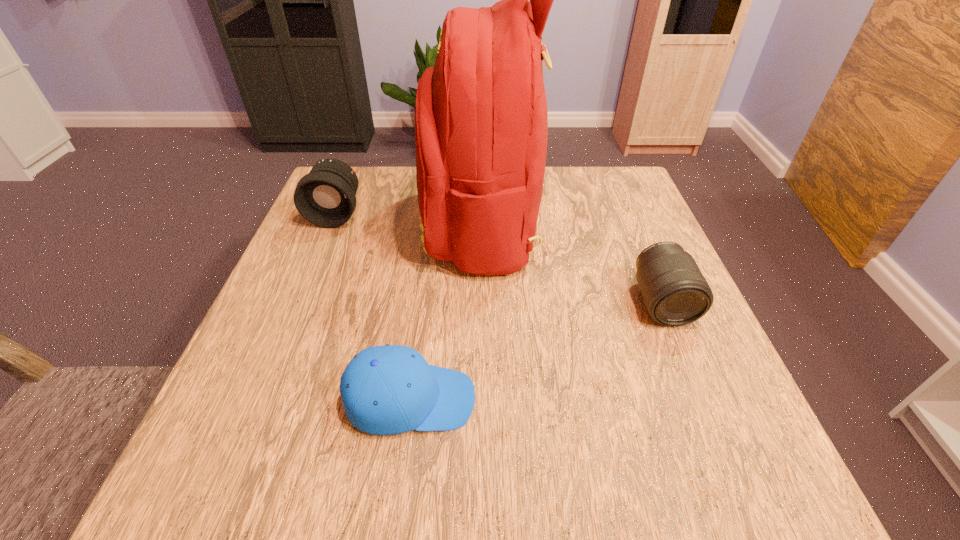
Image resolution: width=960 pixels, height=540 pixels. I want to click on the tallest object, so click(481, 121).

Locate an element on the screen. the left telephoto lens is located at coordinates (325, 196).

Find the location of a particular element. the leftmost object is located at coordinates (325, 196).

The width and height of the screenshot is (960, 540). I want to click on the nearer telephoto lens, so click(x=675, y=293).

Locate an element on the screen. the rightmost object is located at coordinates (675, 293).

Locate an element on the screen. The height and width of the screenshot is (540, 960). cap is located at coordinates (390, 389).

The image size is (960, 540). I want to click on vacant space located on the front-facing side of the backpack, so click(379, 224).

At what (x,y) coordinates should I click in order to perform the action: click on free space located on the front-facing side of the backpack. Please return your answer as a coordinate pair (x, y). Looking at the image, I should click on (384, 224).

Identify the location of vacant region located on the front-facing side of the backpack. This screenshot has height=540, width=960. (354, 224).

This screenshot has height=540, width=960. What are the coordinates of `vacant region located at the front element of the leftmost object` in the screenshot? It's located at (300, 303).